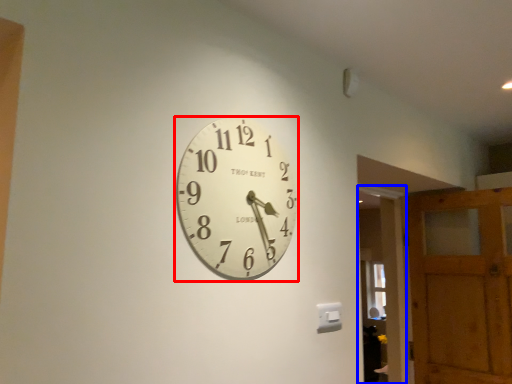
Question: Which object is further to the camera taking this photo, wall clock (highlighted by a red box) or glass door (highlighted by a blue box)?

Choices:
 (A) wall clock
 (B) glass door

Answer: (B)